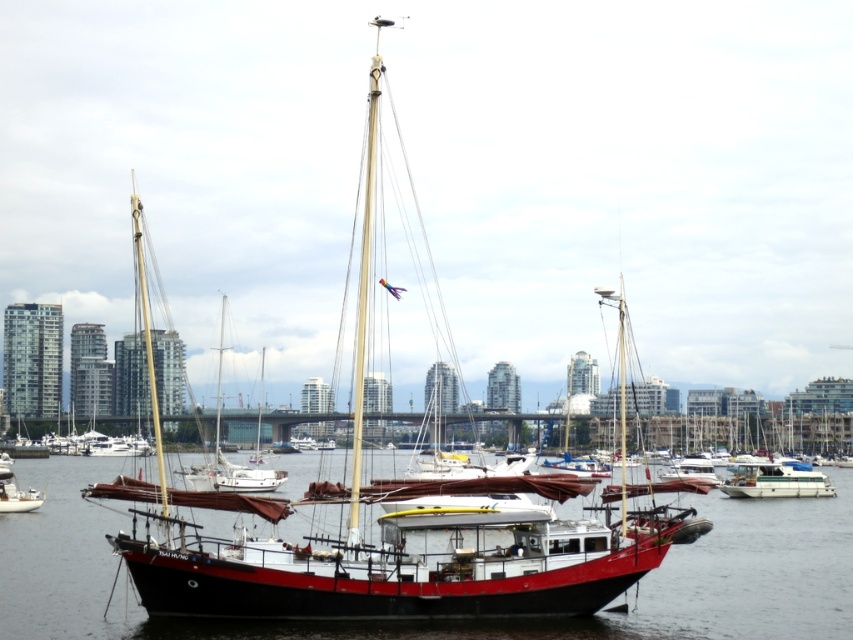
You are a photographer standing at the edge of the dock. You want to take a picture of the red matte sailboat at center. If your camera has a zoom lens that can focus on objects at coordinates between 0.7 and 0.9 on the x and y axes, will the sailboat be within the focus range?

The red matte sailboat at center is located at coordinates (392, 534). Since the x coordinate 0.836 falls within the 0.7 to 0.9 range, but the y coordinate 0.460 is below the lower limit of 0.7, the sailboat will not be within the focus range of the camera.

You are a harbor security officer who needs to ensure that all boats maintain a minimum distance of 150 feet between them for safety. You observe the white glossy catamaran at center and the matte black sailboat at left in the scene. Can you confirm if they are compliant with the safety regulations?

The white glossy catamaran at center and the matte black sailboat at left are 171.13 feet apart from each other, which exceeds the required 150 feet minimum distance. Therefore, they are compliant with the safety regulations.

You are standing at the edge of the harbor and see two points marked in the image. The first point is labeled as point (641, 529) and the second is point (16, 504). Which point is closer to you?

Point (641, 529) is in front of point (16, 504), so it is closer to you.